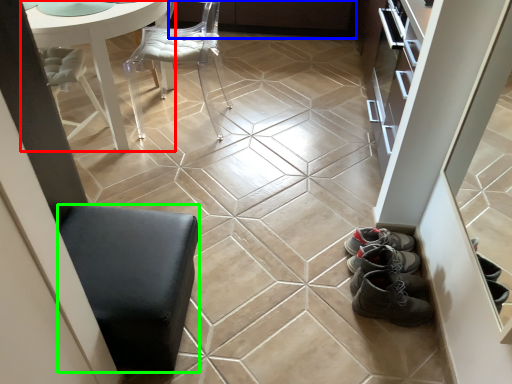
Question: Which object is the closest to the table (highlighted by a red box)? Choose among these: cabinetry (highlighted by a blue box) or furniture (highlighted by a green box).

Choices:
 (A) cabinetry
 (B) furniture

Answer: (B)